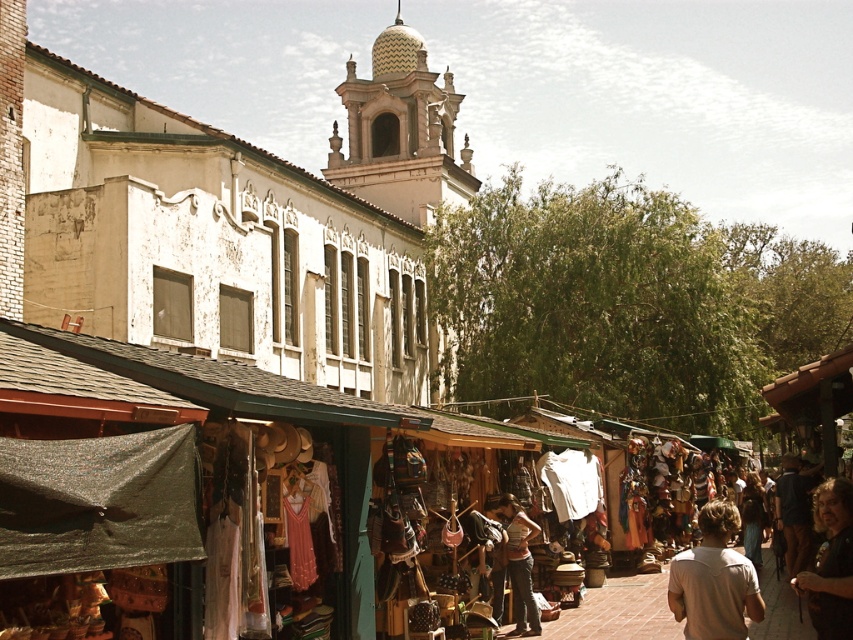
You are a customer at the market and want to purchase both the light beige cotton shirt at lower right and the light brown leather purse at center. If you need to carry them in a bag that can only hold items up to the size of the purse, will the shirt fit?

The light beige cotton shirt at lower right is larger than the light brown leather purse at center. Since the bag can only hold items up to the size of the purse, the shirt will not fit in the bag.

Consider the image. You are a customer at the market and want to buy both the light beige cotton shirt at lower right and the brown leather jacket at lower right. The vendor has a small display rack that can only hold items up to 30 cm in width. Which item should you ask the vendor to place on the rack first to ensure both fit?

The light beige cotton shirt at lower right might be wider than the brown leather jacket at lower right. To ensure both items fit on the rack, you should place the wider item first, which is the light beige cotton shirt at lower right, followed by the brown leather jacket at lower right. However, there is uncertainty about their exact widths, so it would be best to check their dimensions with the vendor.